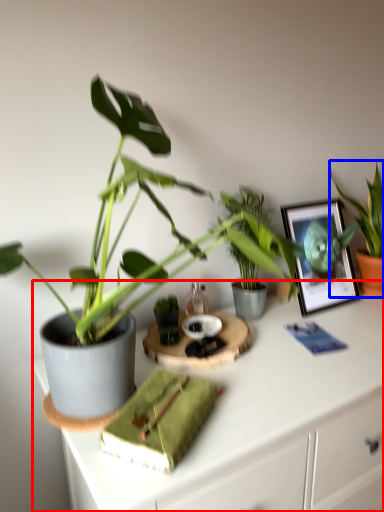
Question: Which object appears closest to the camera in this image, desk (highlighted by a red box) or houseplant (highlighted by a blue box)?

Choices:
 (A) desk
 (B) houseplant

Answer: (A)